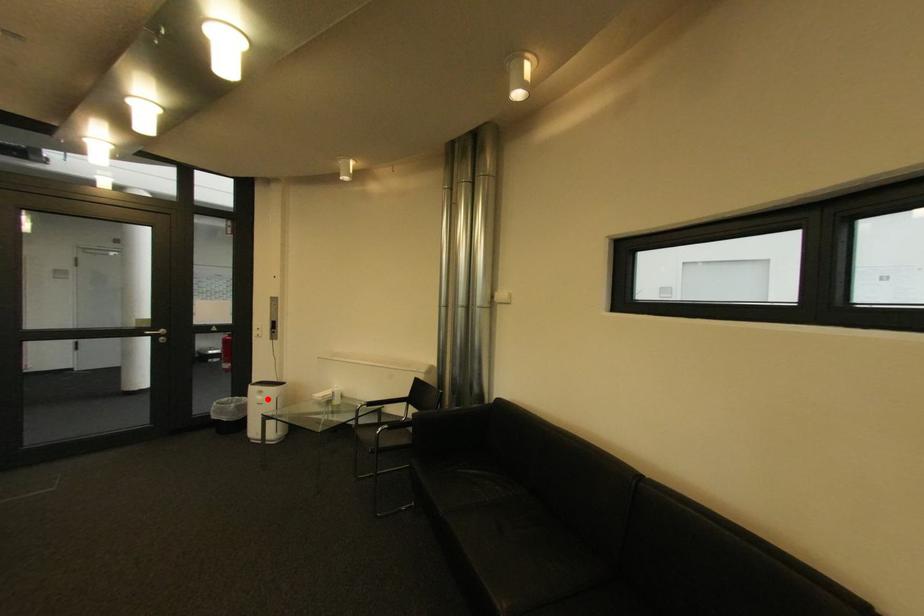
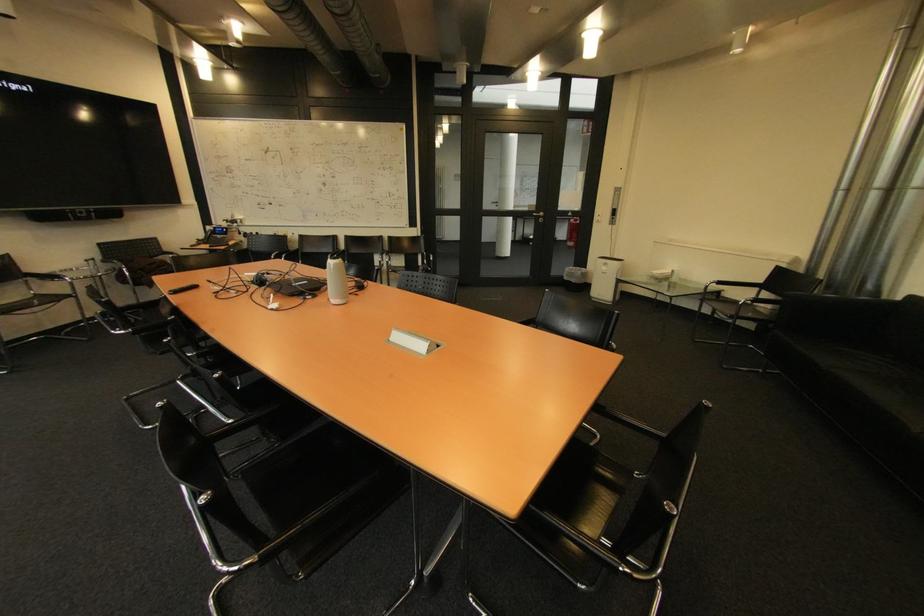
Question: I am providing you with two images of the same scene from different viewpoints. A red point is shown in image1. For the corresponding object point in image2, is it positioned nearer or farther from the camera?

Choices:
 (A) Nearer
 (B) Farther

Answer: (A)